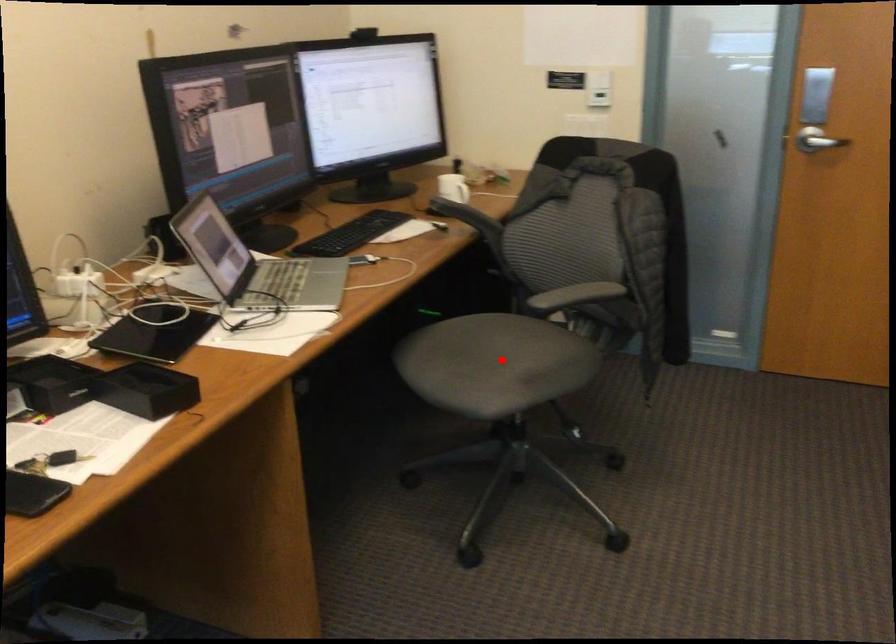
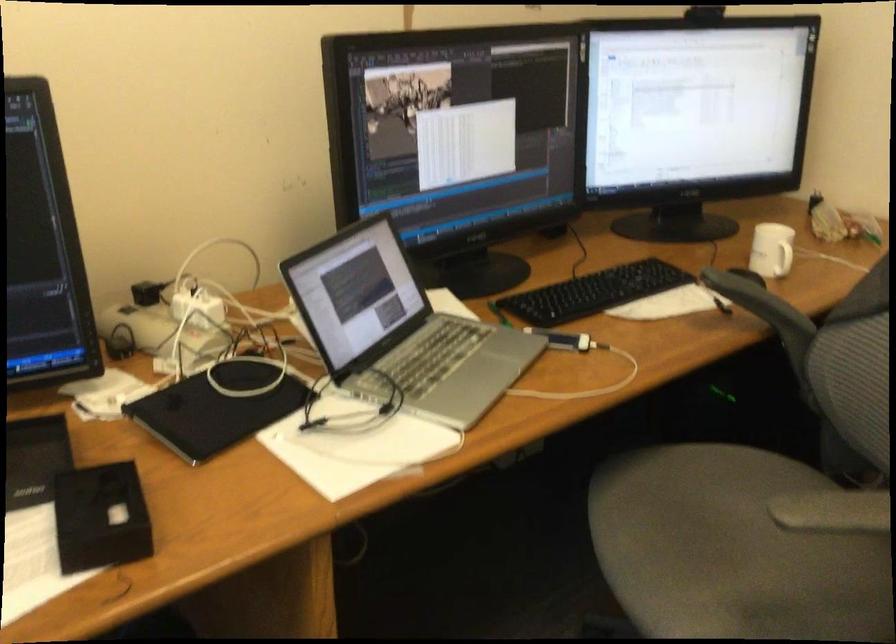
The point at the highlighted location is marked in the first image. Where is the corresponding point in the second image?

(733, 550)